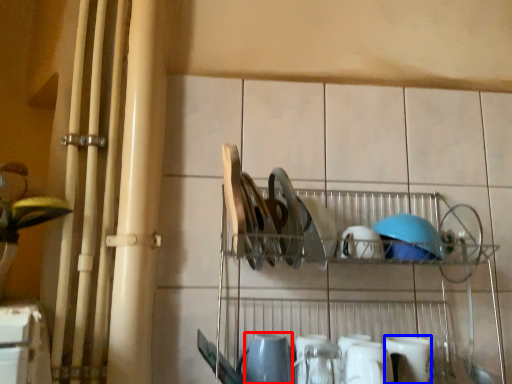
Question: Among these objects, which one is nearest to the camera, tableware (highlighted by a red box) or tableware (highlighted by a blue box)?

Choices:
 (A) tableware
 (B) tableware

Answer: (A)